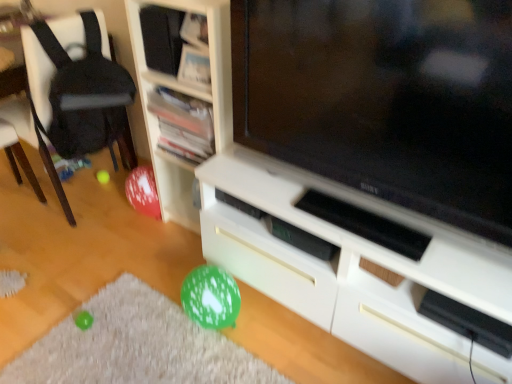
Locate an element on the screen. free location to the left of white wood shelf at center, positioned as the first shelf in bottom-to-top order is located at coordinates (133, 242).